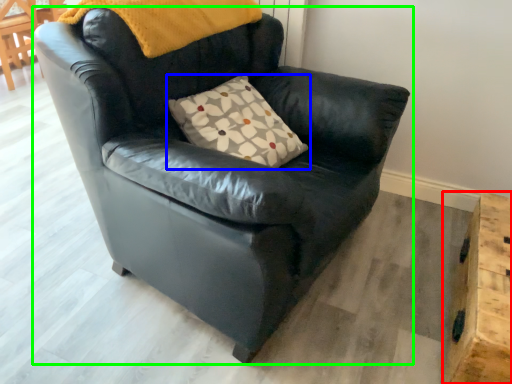
Question: Estimate the real-world distances between objects in this image. Which object is farther from table (highlighted by a red box), pillow (highlighted by a blue box) or chair (highlighted by a green box)?

Choices:
 (A) pillow
 (B) chair

Answer: (A)